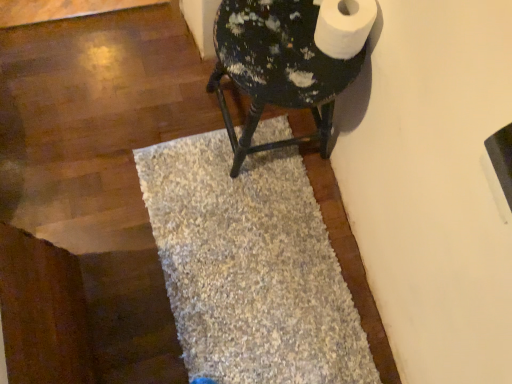
At what (x,y) coordinates should I click in order to perform the action: click on vacant position to the left of painted wood stool at upper right. Please return your answer as a coordinate pair (x, y). Image resolution: width=512 pixels, height=384 pixels. Looking at the image, I should click on 168,94.